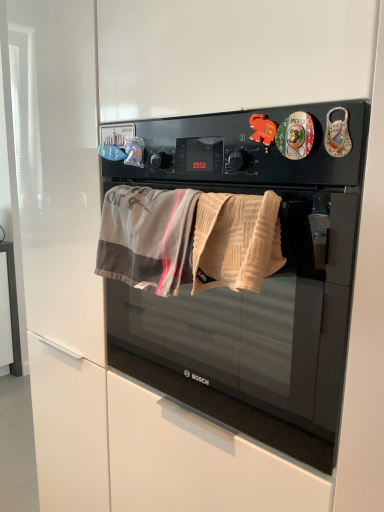
Question: From a real-world perspective, is black matte microwave oven at center located higher than gray cotton beach towel at center, the second beach towel from the right?

Choices:
 (A) no
 (B) yes

Answer: (A)

Question: Are black matte microwave oven at center and gray cotton beach towel at center, the second beach towel from the right, located far from each other?

Choices:
 (A) yes
 (B) no

Answer: (B)

Question: From the image's perspective, is black matte microwave oven at center located beneath gray cotton beach towel at center, the second beach towel from the right?

Choices:
 (A) no
 (B) yes

Answer: (B)

Question: Is black matte microwave oven at center next to gray cotton beach towel at center, which appears as the first beach towel when viewed from the left, and touching it?

Choices:
 (A) yes
 (B) no

Answer: (B)

Question: Is black matte microwave oven at center turned away from gray cotton beach towel at center, which appears as the first beach towel when viewed from the left?

Choices:
 (A) no
 (B) yes

Answer: (A)

Question: Is point (205, 254) positioned closer to the camera than point (221, 384)?

Choices:
 (A) farther
 (B) closer

Answer: (B)

Question: Relative to black matte microwave oven at center, is beige textured towel at center, which ranks as the second beach towel in left-to-right order, in front or behind?

Choices:
 (A) front
 (B) behind

Answer: (B)

Question: From a real-world perspective, is beige textured towel at center, which ranks as the second beach towel in left-to-right order, physically located above or below black matte microwave oven at center?

Choices:
 (A) above
 (B) below

Answer: (A)

Question: Is beige textured towel at center, the 1th beach towel from the right, to the left or to the right of black matte microwave oven at center in the image?

Choices:
 (A) right
 (B) left

Answer: (B)

Question: In terms of size, does gray cotton beach towel at center, which appears as the first beach towel when viewed from the left, appear bigger or smaller than black matte microwave oven at center?

Choices:
 (A) small
 (B) big

Answer: (A)

Question: In terms of height, does gray cotton beach towel at center, the second beach towel from the right, look taller or shorter compared to black matte microwave oven at center?

Choices:
 (A) tall
 (B) short

Answer: (B)

Question: From the image's perspective, relative to black matte microwave oven at center, is gray cotton beach towel at center, the second beach towel from the right, above or below?

Choices:
 (A) above
 (B) below

Answer: (A)

Question: Is gray cotton beach towel at center, which appears as the first beach towel when viewed from the left, in front of or behind black matte microwave oven at center in the image?

Choices:
 (A) behind
 (B) front

Answer: (A)

Question: Is beige textured towel at center, the 1th beach towel from the right, in front of or behind gray cotton beach towel at center, which appears as the first beach towel when viewed from the left, in the image?

Choices:
 (A) behind
 (B) front

Answer: (B)

Question: Considering the positions of beige textured towel at center, the 1th beach towel from the right, and gray cotton beach towel at center, which appears as the first beach towel when viewed from the left, in the image, is beige textured towel at center, the 1th beach towel from the right, bigger or smaller than gray cotton beach towel at center, which appears as the first beach towel when viewed from the left,?

Choices:
 (A) small
 (B) big

Answer: (A)